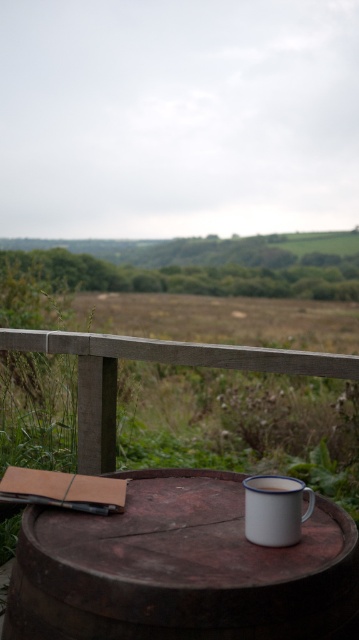
Question: From the image, what is the correct spatial relationship of rustic wooden barrel at center in relation to wooden rail at upper center?

Choices:
 (A) below
 (B) above

Answer: (A)

Question: Is wooden rail at upper center thinner than white enamel mug at lower right?

Choices:
 (A) yes
 (B) no

Answer: (B)

Question: Can you confirm if rustic wooden barrel at center is positioned to the left of white enamel mug at lower right?

Choices:
 (A) yes
 (B) no

Answer: (A)

Question: Which of the following is the farthest from the observer?

Choices:
 (A) [x=151, y=566]
 (B) [x=290, y=484]
 (C) [x=198, y=362]

Answer: (C)

Question: Which of the following is the closest to the observer?

Choices:
 (A) (280, 349)
 (B) (268, 544)
 (C) (356, 572)

Answer: (C)

Question: Which point is closer to the camera?

Choices:
 (A) (296, 531)
 (B) (132, 556)
 (C) (90, 452)

Answer: (B)